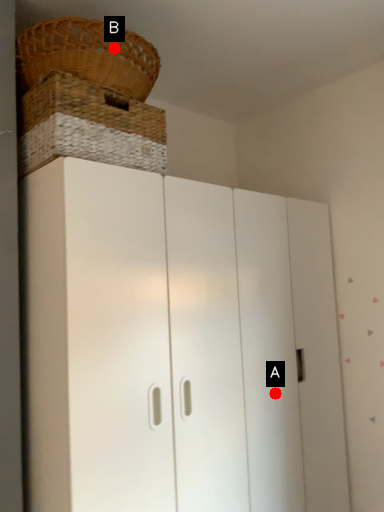
Question: Two points are circled on the image, labeled by A and B beside each circle. Which point is closer to the camera?

Choices:
 (A) A is closer
 (B) B is closer

Answer: (B)